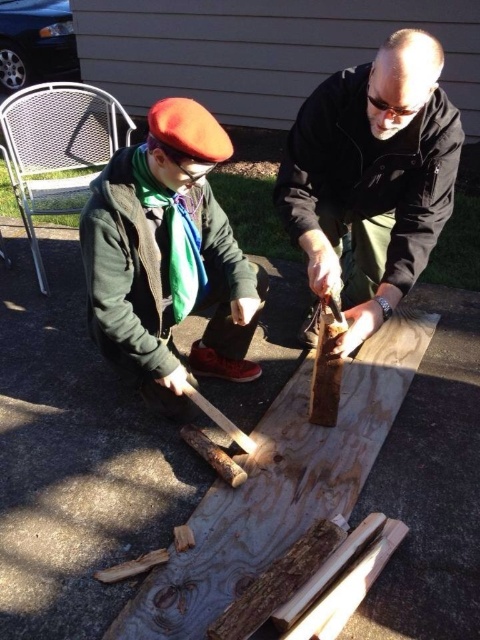
Question: Which of these objects is positioned farthest from the wooden plank at center?

Choices:
 (A) matte green jacket at center
 (B) matte black shirt at center

Answer: (B)

Question: Which of these objects is positioned closest to the wooden plank at center?

Choices:
 (A) matte black shirt at center
 (B) matte green jacket at center

Answer: (B)

Question: Is matte black shirt at center behind wooden plank at center?

Choices:
 (A) yes
 (B) no

Answer: (A)

Question: Which object is the closest to the matte black shirt at center?

Choices:
 (A) wooden plank at center
 (B) matte green jacket at center

Answer: (B)

Question: Can you confirm if matte black shirt at center is positioned to the right of wooden plank at center?

Choices:
 (A) no
 (B) yes

Answer: (B)

Question: Is matte black shirt at center wider than wooden plank at center?

Choices:
 (A) no
 (B) yes

Answer: (A)